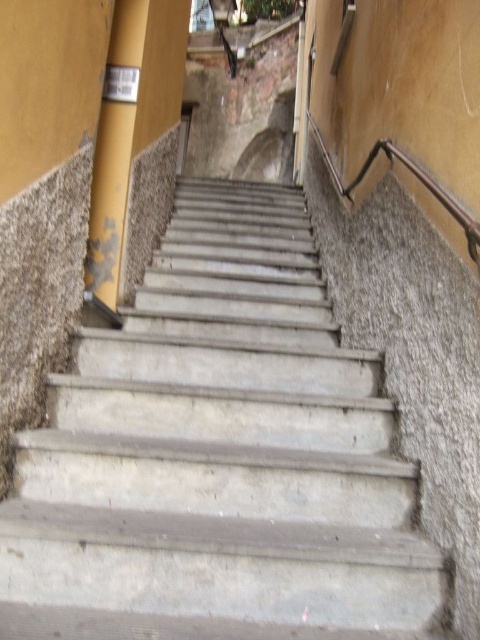
Question: Among these objects, which one is farthest from the camera?

Choices:
 (A) yellow matte pole at upper left
 (B) concrete stairs at center

Answer: (A)

Question: Can you confirm if concrete stairs at center is smaller than yellow matte pole at upper left?

Choices:
 (A) yes
 (B) no

Answer: (B)

Question: Does concrete stairs at center have a larger size compared to yellow matte pole at upper left?

Choices:
 (A) yes
 (B) no

Answer: (A)

Question: Does concrete stairs at center have a greater width compared to yellow matte pole at upper left?

Choices:
 (A) no
 (B) yes

Answer: (B)

Question: Which point is farther to the camera?

Choices:
 (A) (103, 243)
 (B) (210, 582)

Answer: (A)